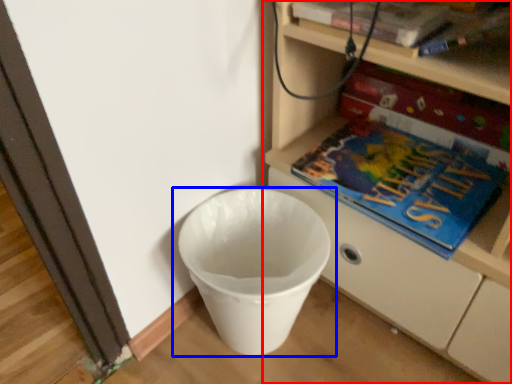
Question: Which of the following is the farthest to the observer, shelf (highlighted by a red box) or waste container (highlighted by a blue box)?

Choices:
 (A) shelf
 (B) waste container

Answer: (B)